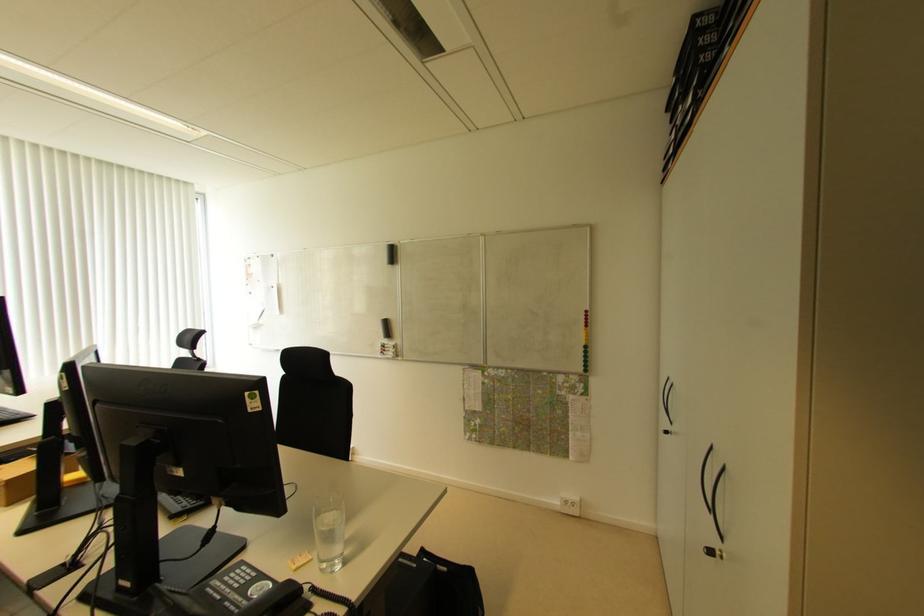
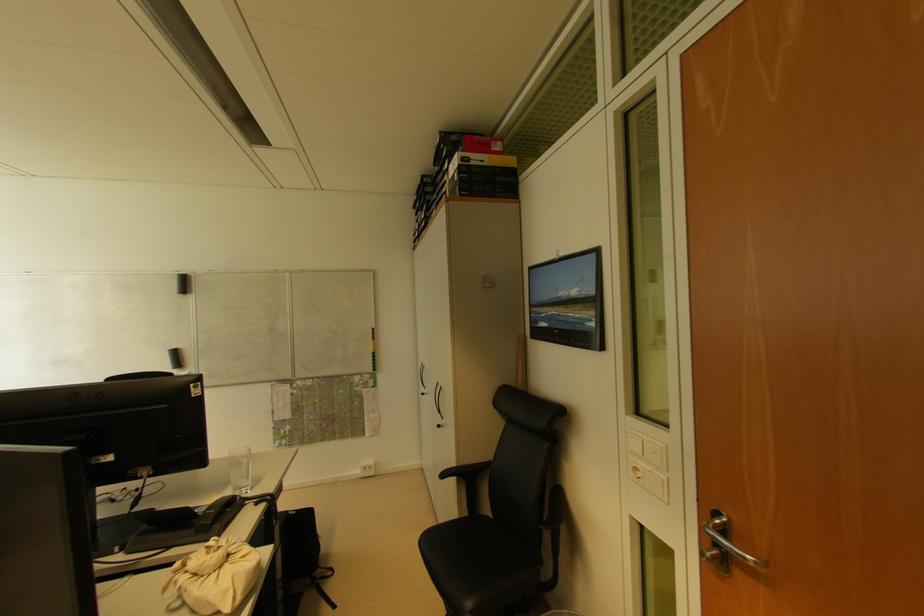
Find the pixel in the second image that matches point 713,452 in the first image.

(440, 387)